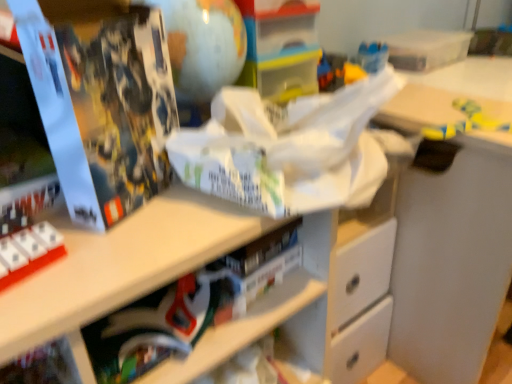
Question: Considering the relative sizes of matte black book at lower center and yellow matte toy at upper right in the image provided, is matte black book at lower center bigger than yellow matte toy at upper right?

Choices:
 (A) no
 (B) yes

Answer: (B)

Question: Is matte black book at lower center to the left of yellow matte toy at upper right from the viewer's perspective?

Choices:
 (A) no
 (B) yes

Answer: (B)

Question: Considering the relative sizes of matte black book at lower center and yellow matte toy at upper right in the image provided, is matte black book at lower center thinner than yellow matte toy at upper right?

Choices:
 (A) yes
 (B) no

Answer: (A)

Question: Is matte black book at lower center further to the viewer compared to yellow matte toy at upper right?

Choices:
 (A) yes
 (B) no

Answer: (B)

Question: Is matte black book at lower center smaller than yellow matte toy at upper right?

Choices:
 (A) no
 (B) yes

Answer: (A)

Question: In terms of size, does matte black book at left appear bigger or smaller than matte black book at lower center?

Choices:
 (A) big
 (B) small

Answer: (A)

Question: Is matte black book at left situated inside matte black book at lower center or outside?

Choices:
 (A) inside
 (B) outside

Answer: (B)

Question: From a real-world perspective, is matte black book at left physically located above or below matte black book at lower center?

Choices:
 (A) below
 (B) above

Answer: (B)

Question: Is matte black book at left in front of or behind matte black book at lower center in the image?

Choices:
 (A) front
 (B) behind

Answer: (A)

Question: In the image, is yellow matte toy at upper right positioned in front of or behind matte black book at lower center?

Choices:
 (A) behind
 (B) front

Answer: (A)

Question: Considering the relative positions of yellow matte toy at upper right and matte black book at lower center in the image provided, is yellow matte toy at upper right to the left or to the right of matte black book at lower center?

Choices:
 (A) left
 (B) right

Answer: (B)

Question: Is yellow matte toy at upper right inside the boundaries of matte black book at lower center, or outside?

Choices:
 (A) outside
 (B) inside

Answer: (A)

Question: In terms of height, does yellow matte toy at upper right look taller or shorter compared to matte black book at lower center?

Choices:
 (A) tall
 (B) short

Answer: (B)

Question: Looking at their shapes, would you say matte black book at lower center is wider or thinner than yellow matte toy at upper right?

Choices:
 (A) wide
 (B) thin

Answer: (B)

Question: Is point (115, 367) positioned closer to the camera than point (480, 119)?

Choices:
 (A) farther
 (B) closer

Answer: (B)